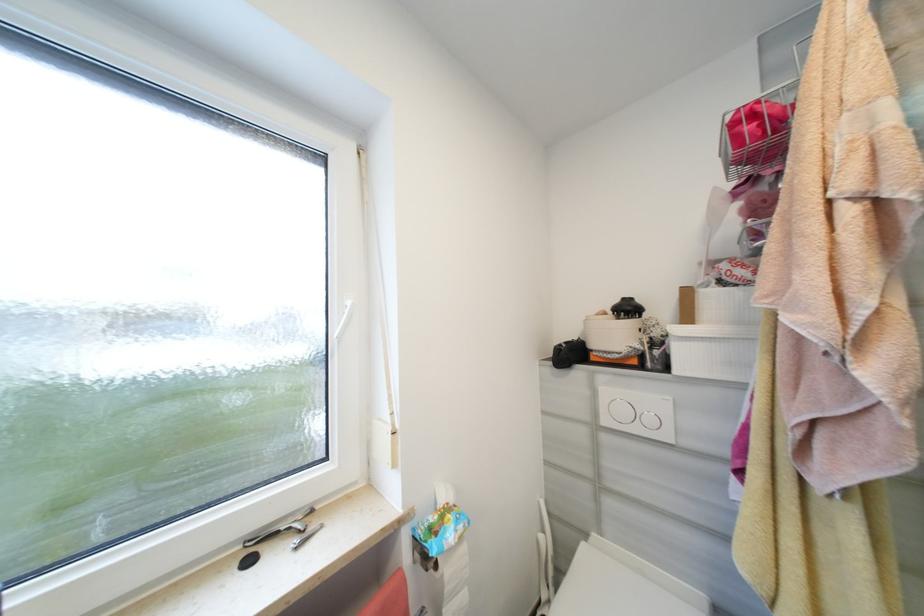
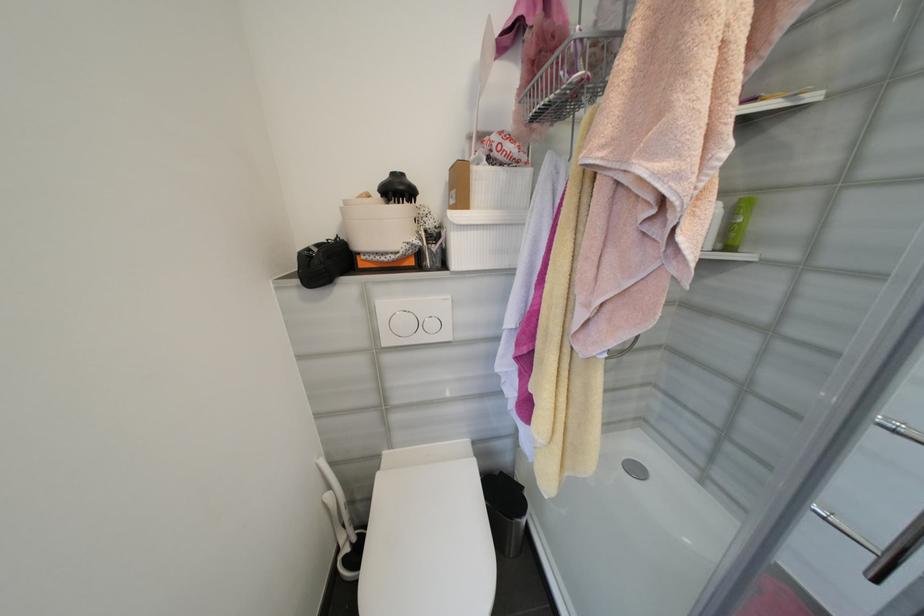
The images are taken continuously from a first-person perspective. In which direction is your viewpoint rotating?

The rotation direction of the camera is right-down.